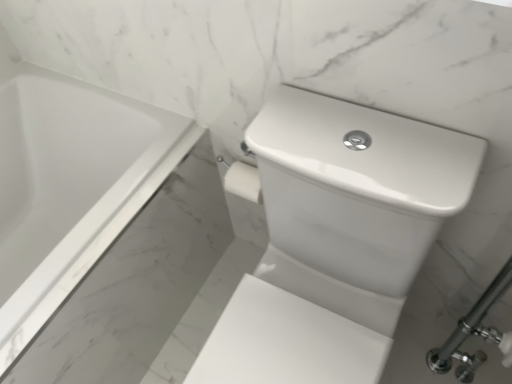
Find the location of a particular element. white glossy bathtub at left is located at coordinates (70, 187).

What is the approximate height of white glossy bathtub at left?

59.01 centimeters.

The image size is (512, 384). Describe the element at coordinates (70, 187) in the screenshot. I see `white glossy bathtub at left` at that location.

This screenshot has height=384, width=512. I want to click on white glossy bathtub at left, so click(70, 187).